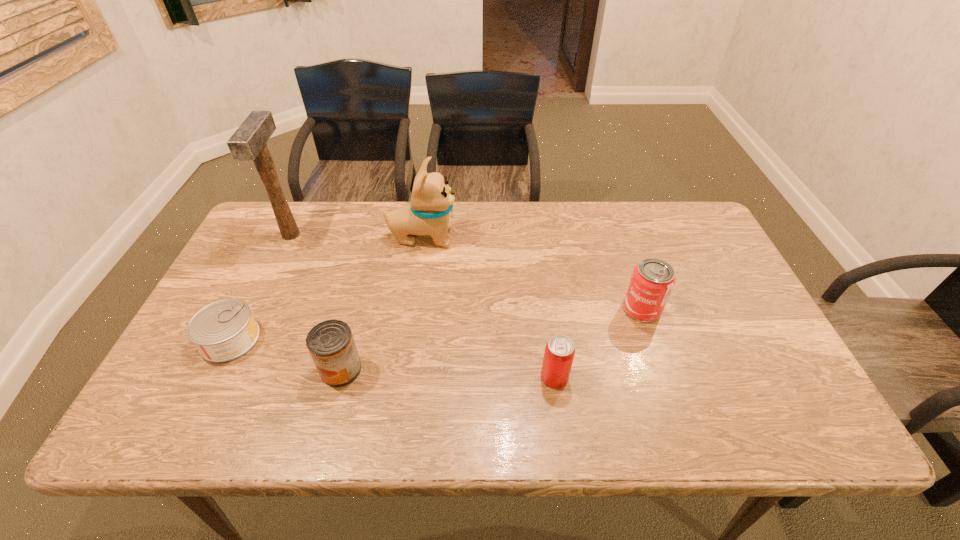
The image size is (960, 540). In the image, there is a desktop. Identify the location of vacant region at the left edge. coord(272,265).

Where is `vacant space at the right edge of the desktop`? vacant space at the right edge of the desktop is located at coordinates (778, 386).

Locate an element on the screen. The width and height of the screenshot is (960, 540). free space at the near left corner of the desktop is located at coordinates (200, 439).

I want to click on blank space at the far right corner, so click(x=674, y=206).

Image resolution: width=960 pixels, height=540 pixels. In order to click on free space at the near right corner of the desktop in this screenshot , I will do `click(823, 430)`.

Locate an element on the screen. The width and height of the screenshot is (960, 540). vacant area that lies between the tallest object and the second can from left to right is located at coordinates (316, 302).

The height and width of the screenshot is (540, 960). Identify the location of blank region between the second tallest object and the rightmost can. (532, 273).

Where is `vacant space in between the second can from right to left and the rightmost can`? The width and height of the screenshot is (960, 540). vacant space in between the second can from right to left and the rightmost can is located at coordinates (598, 343).

Where is `free spot between the tallest object and the shortest can`? free spot between the tallest object and the shortest can is located at coordinates (260, 287).

Identify the location of vacant area that lies between the mallet and the rightmost object. (467, 272).